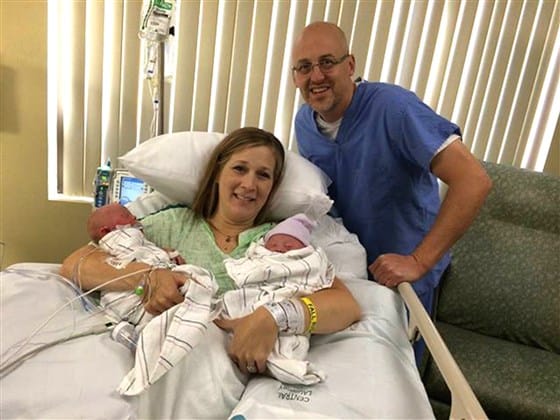
Image resolution: width=560 pixels, height=420 pixels. Identify the location of blankets. (161, 332), (274, 270).